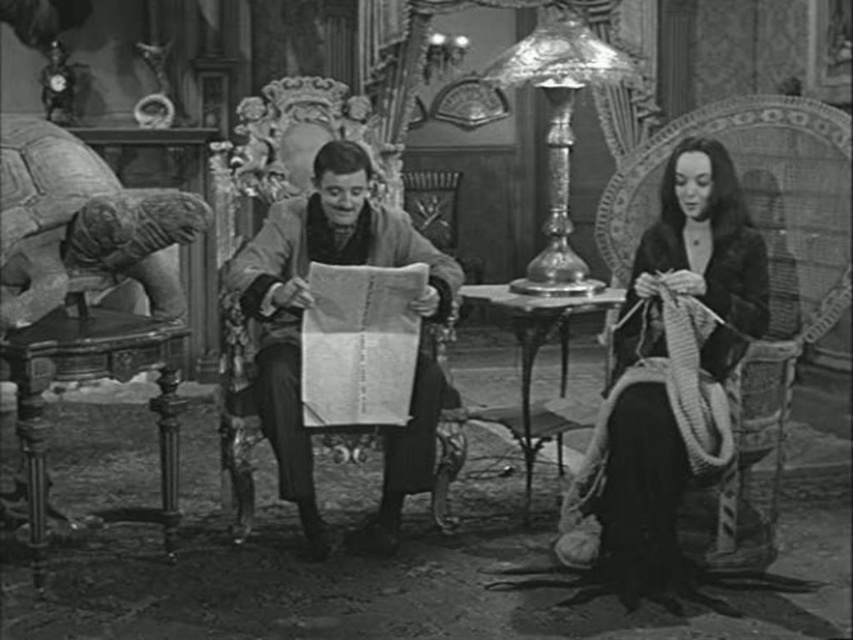
Based on the scene description, can you determine the spatial relationship between the smooth brown coat at center and the shiny glass lamp at center?

The smooth brown coat at center is below the shiny glass lamp at center.

You are a costume designer preparing for a play and need to know the size relationship between the velvet black dress at right and the shiny glass lamp at center in the image. Which object is larger?

The velvet black dress at right is bigger than the shiny glass lamp at center, so the velvet black dress at right is larger.

Based on the photo, you are standing in the room and want to reach the point marked at coordinates (641,314). The room has a door 15 feet away from you. Can you reach the point before exiting through the door?

The point marked at coordinates (641,314) is 14.89 feet from the camera, which is slightly closer than the door that is 15 feet away. Therefore, you can reach the point before exiting through the door.